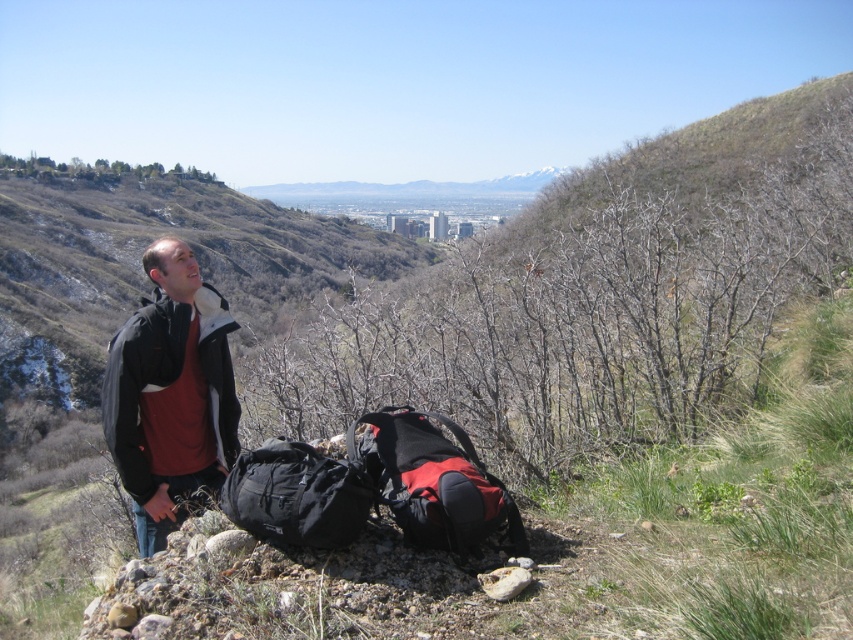
You are a hiker who just arrived at the rocky outcrop. You need to place your red matte backpack at center on the ground. Given the terrain details described in the scene, is the ground suitable for placing the backpack?

The ground has rocks and small stones scattered across it, so placing the red matte backpack at center might be unstable due to the uneven terrain.

You are the hiker in the image and want to move towards the city in the valley. Which point should you step on first, point(418, 506) or point(318, 504)?

You should step on point(318, 504) first because point(418, 506) is behind it, so stepping on the closer point first would be more efficient when moving towards the city in the valley.

You are a drone operator trying to capture a photo of the dark gray fleece jacket at center. The camera is positioned at the origin point. Which direction should you move the camera to get the jacket into the frame?

The dark gray fleece jacket at center is located at point 0.614 on the x axis and 0.200 on the y axis. Since the camera is at the origin point, you should move the camera to the right along the x axis to position 0.614 and slightly upwards along the y axis to position 0.200 to center the jacket in the frame.